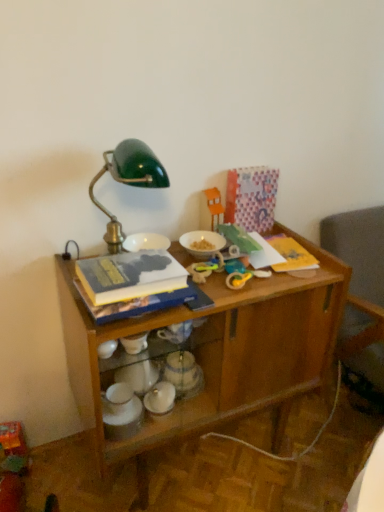
Find the location of a particular element. vacant point to the right of rubber yellow toy at center, acting as the second toy starting from the back is located at coordinates (273, 276).